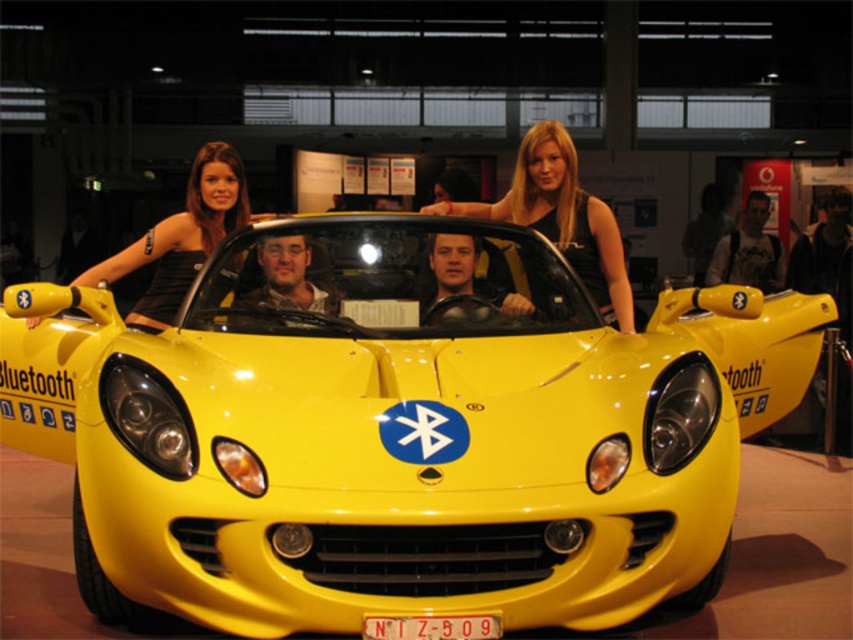
You are a photographer trying to capture a clear shot of the yellow plastic license plate at center. However, the black fabric top at upper center is blocking your view. Can you adjust your position to see the license plate without moving the car?

The black fabric top at upper center is positioned over the yellow plastic license plate at center, so adjusting your position to look underneath the fabric top might allow you to see the license plate without moving the car.

You are attending an event and want to take a photo of the black satin dress at upper left while avoiding the sports car. Can you confirm if the dress is positioned away from the car?

The black satin dress at upper left is located at point (181,237), which is away from the sports car, so you can take the photo without including the car.

Based on the photo, you are a photographer at the exhibition and want to capture a photo that includes both the black satin dress at upper left and the yellow plastic license plate at center. Which object should you adjust your camera angle to focus on first to ensure both are in frame?

The black satin dress at upper left has a lesser width compared to the yellow plastic license plate at center, so you should focus on the wider yellow plastic license plate at center first to ensure both fit within the frame.